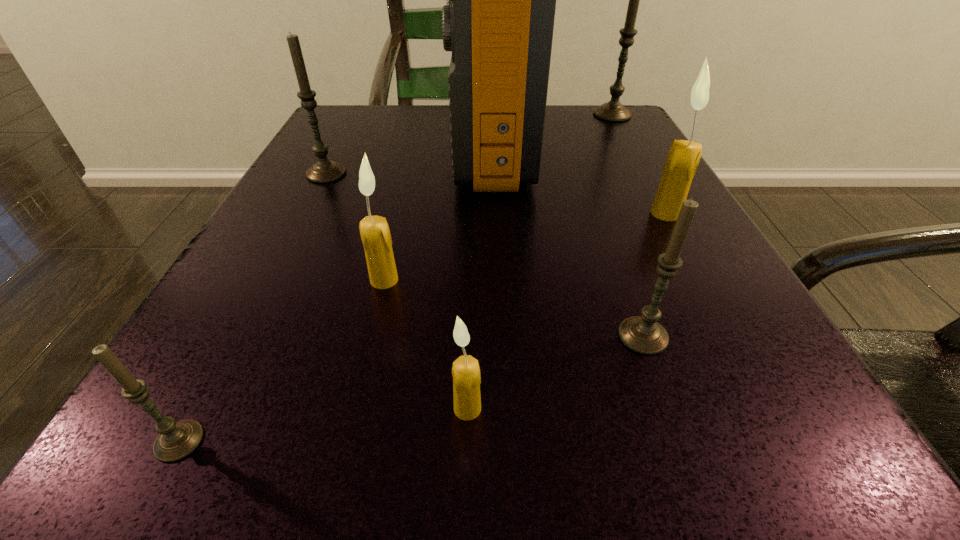
Image resolution: width=960 pixels, height=540 pixels. In order to click on vacant space at the left edge in this screenshot , I will do `click(287, 179)`.

In the image, there is a desktop. What are the coordinates of `vacant space at the right edge` in the screenshot? It's located at (659, 249).

I want to click on vacant space at the far left corner, so click(x=396, y=127).

In the image, there is a desktop. Identify the location of vacant space at the near left corner. The height and width of the screenshot is (540, 960). (237, 405).

Image resolution: width=960 pixels, height=540 pixels. In order to click on free spot at the far right corner of the desktop in this screenshot , I will do 606,128.

I want to click on vacant space in between the biggest cream candle and the biggest gray candle, so click(639, 164).

Locate an element on the screen. This screenshot has height=540, width=960. free space that is in between the fifth nearest object and the nearest object is located at coordinates (422, 327).

You are a GUI agent. You are given a task and a screenshot of the screen. Output one action in this format:
    pyautogui.click(x=<x>, y=<y>)
    Task: Click on the vacant space in between the third smallest gray candle and the tallest object
    
    Given the screenshot: What is the action you would take?
    pyautogui.click(x=409, y=160)

You are a GUI agent. You are given a task and a screenshot of the screen. Output one action in this format:
    pyautogui.click(x=<x>, y=<y>)
    Task: Click on the free space between the biggest cream candle and the smallest cream candle
    This screenshot has width=960, height=540.
    Given the screenshot: What is the action you would take?
    pyautogui.click(x=566, y=310)

At what (x,y) coordinates should I click in order to perform the action: click on vacant space that's between the sixth object from left to right and the nearest cream candle. Please return your answer as a coordinate pair (x, y). Looking at the image, I should click on (555, 372).